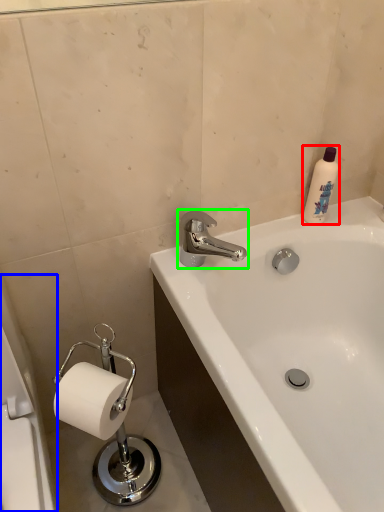
Question: Which object is positioned farthest from cleaning product (highlighted by a red box)? Select from bath (highlighted by a blue box) and tap (highlighted by a green box).

Choices:
 (A) bath
 (B) tap

Answer: (A)